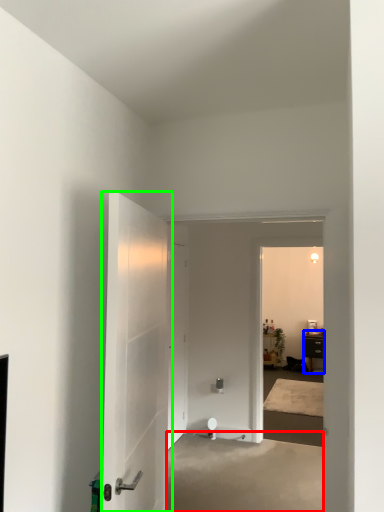
Question: Based on their relative distances, which object is nearer to concrete (highlighted by a red box)? Choose from furniture (highlighted by a blue box) and door (highlighted by a green box).

Choices:
 (A) furniture
 (B) door

Answer: (B)